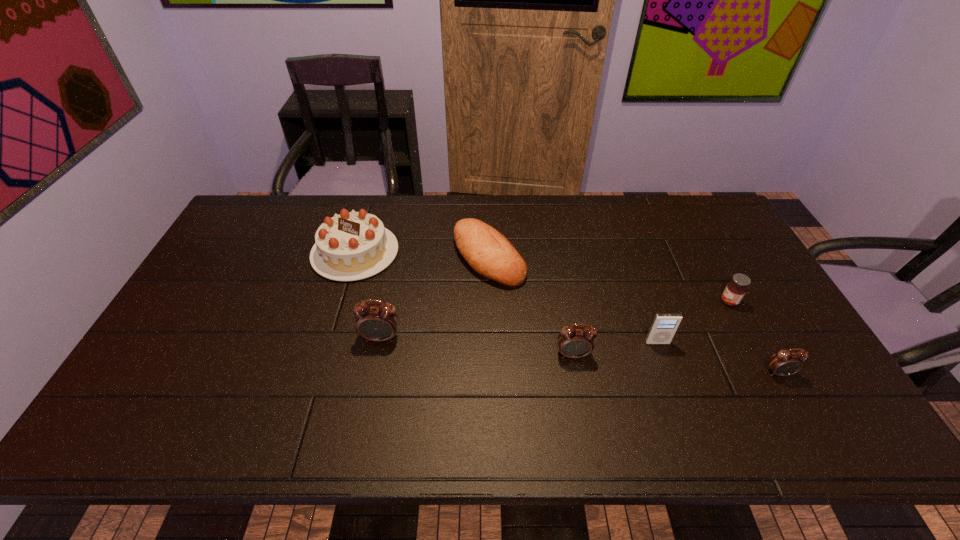
You are a GUI agent. You are given a task and a screenshot of the screen. Output one action in this format:
    pyautogui.click(x=<x>, y=<y>)
    Task: Click on the farthest alarm clock
    The height and width of the screenshot is (540, 960).
    Given the screenshot: What is the action you would take?
    pyautogui.click(x=375, y=322)

You are a GUI agent. You are given a task and a screenshot of the screen. Output one action in this format:
    pyautogui.click(x=<x>, y=<y>)
    Task: Click on the tallest alarm clock
    
    Given the screenshot: What is the action you would take?
    pyautogui.click(x=375, y=322)

In order to click on the second nearest object in this screenshot , I will do `click(573, 342)`.

Find the location of `the fourth object from right to left`. the fourth object from right to left is located at coordinates (573, 342).

The height and width of the screenshot is (540, 960). Identify the location of the nearest object. (786, 362).

The image size is (960, 540). What are the coordinates of `the rightmost alarm clock` in the screenshot? It's located at (786, 362).

You are a GUI agent. You are given a task and a screenshot of the screen. Output one action in this format:
    pyautogui.click(x=<x>, y=<y>)
    Task: Click on the fifth nearest object
    The height and width of the screenshot is (540, 960).
    Given the screenshot: What is the action you would take?
    pyautogui.click(x=735, y=290)

This screenshot has width=960, height=540. Find the location of `bread`. bread is located at coordinates (490, 254).

Where is `birthday cake`? This screenshot has width=960, height=540. birthday cake is located at coordinates (351, 246).

Locate an element on the screen. The image size is (960, 540). the fifth object from left to right is located at coordinates (664, 326).